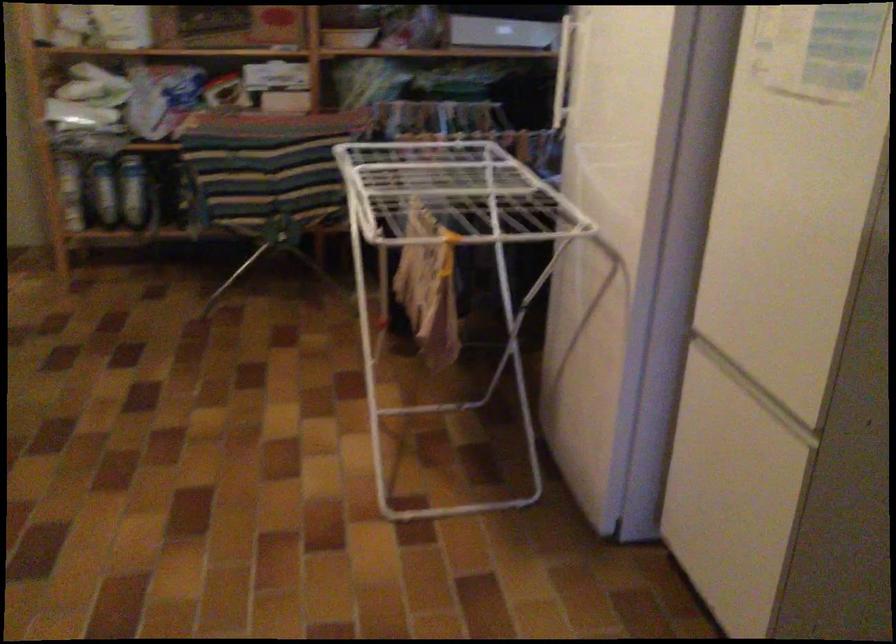
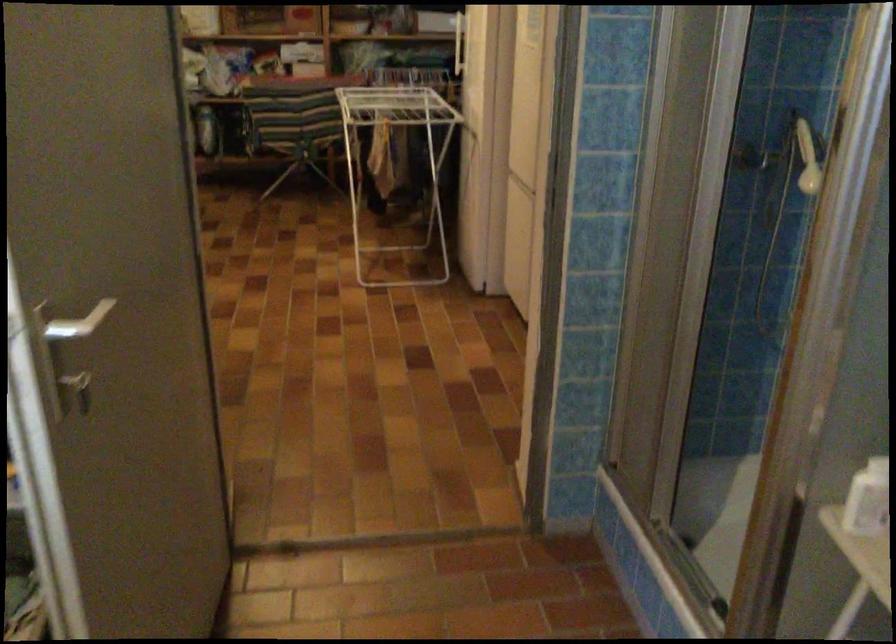
Question: I am providing you with two images of the same scene from different viewpoints. Which of the following objects are not visible in image2?

Choices:
 (A) blue bottle
 (B) chair sitting surface
 (C) brass doorknob
 (D) white shower head

Answer: (A)